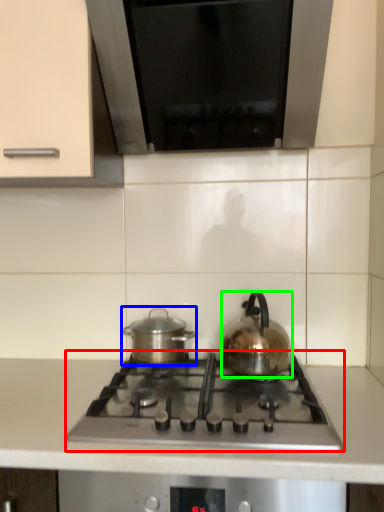
Question: Which object is the farthest from gas stove (highlighted by a red box)? Choose among these: kitchen appliance (highlighted by a blue box) or kettle (highlighted by a green box).

Choices:
 (A) kitchen appliance
 (B) kettle

Answer: (A)